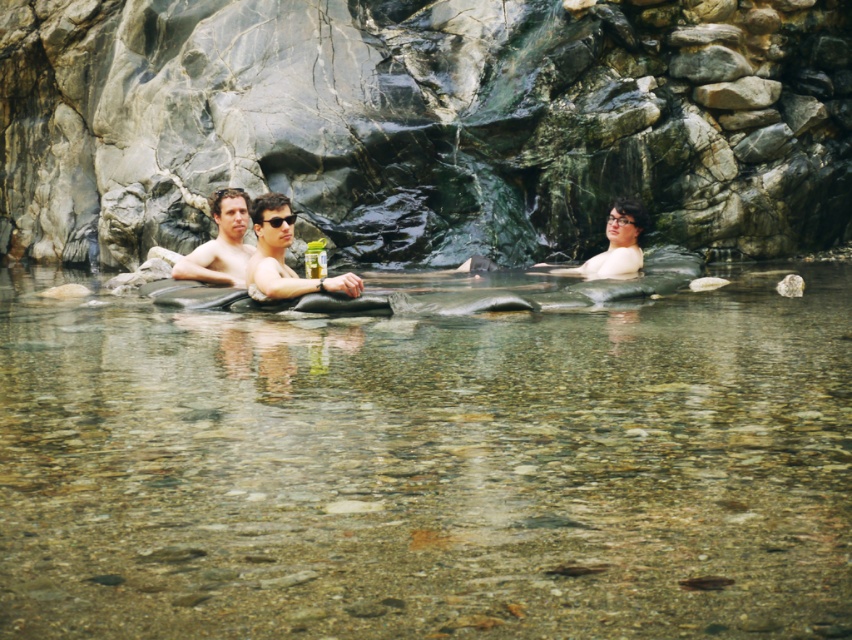
Question: Can you confirm if smooth skin couple at center is positioned to the left of smooth skin woman at center?

Choices:
 (A) yes
 (B) no

Answer: (A)

Question: Which point is closer to the camera taking this photo?

Choices:
 (A) (124, 492)
 (B) (199, 260)
 (C) (255, 269)

Answer: (A)

Question: Does clear stone river at center appear under smooth skin couple at center?

Choices:
 (A) yes
 (B) no

Answer: (A)

Question: Based on their relative distances, which object is nearer to the smooth skin couple at center?

Choices:
 (A) smooth skin man at center
 (B) smooth skin woman at center

Answer: (B)

Question: Which object is positioned closest to the clear stone river at center?

Choices:
 (A) smooth skin man at center
 (B) smooth skin couple at center

Answer: (B)

Question: Is clear stone river at center closer to camera compared to smooth skin man at center?

Choices:
 (A) yes
 (B) no

Answer: (A)